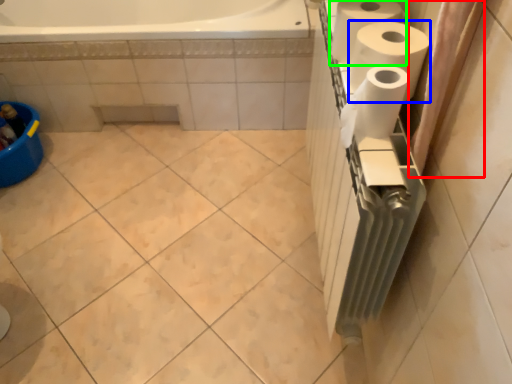
Question: Which is nearer to the shower curtain (highlighted by a red box)? paper towel (highlighted by a blue box) or paper towel (highlighted by a green box).

Choices:
 (A) paper towel
 (B) paper towel

Answer: (A)